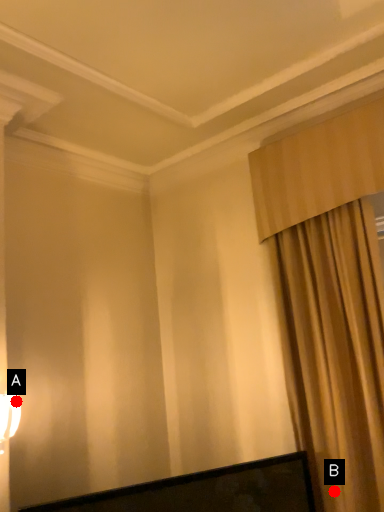
Question: Two points are circled on the image, labeled by A and B beside each circle. Which point appears farthest from the camera in this image?

Choices:
 (A) A is further
 (B) B is further

Answer: (B)